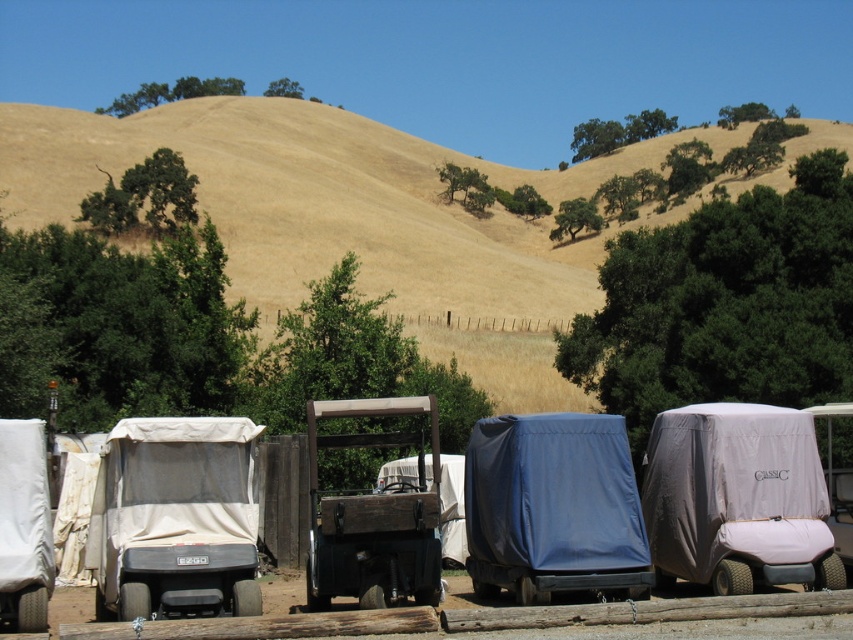
You are a maintenance worker inspecting the golf carts. You need to determine which golf cart cover is shorter in height between the gray fabric golf cart at center right and the blue tarp golf cart at center. Which one is shorter?

The gray fabric golf cart at center right is not as tall as the blue tarp golf cart at center, so the gray fabric golf cart at center right has a shorter cover height.

You are standing at the origin point of the image coordinate system. The golf carts are parked at coordinates ranging from 0.1 to 0.2 in the x and y axes. Where would you find the dried grass at center?

The dried grass at center is located at coordinates point (367, 216), which is further to the right and above the parked golf carts.